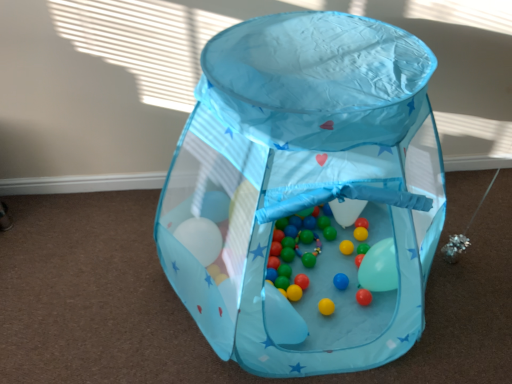
Question: Visually, is matte plastic balls at center positioned to the left or to the right of transparent fabric playpen at center?

Choices:
 (A) left
 (B) right

Answer: (B)

Question: From the image's perspective, is matte plastic balls at center located above or below transparent fabric playpen at center?

Choices:
 (A) above
 (B) below

Answer: (B)

Question: Is point (280, 251) positioned closer to the camera than point (393, 238)?

Choices:
 (A) closer
 (B) farther

Answer: (B)

Question: Relative to matte plastic balls at center, is transparent fabric playpen at center in front or behind?

Choices:
 (A) behind
 (B) front

Answer: (B)

Question: Is transparent fabric playpen at center taller or shorter than matte plastic balls at center?

Choices:
 (A) short
 (B) tall

Answer: (B)

Question: From the image's perspective, is transparent fabric playpen at center above or below matte plastic balls at center?

Choices:
 (A) above
 (B) below

Answer: (A)

Question: In terms of size, does transparent fabric playpen at center appear bigger or smaller than matte plastic balls at center?

Choices:
 (A) big
 (B) small

Answer: (A)